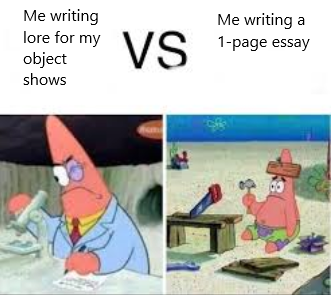
At what (x,y) coordinates should I click in order to perform the action: click on pen. Please return your answer as a coordinate pair (x, y). The height and width of the screenshot is (295, 333). Looking at the image, I should click on (81, 247).